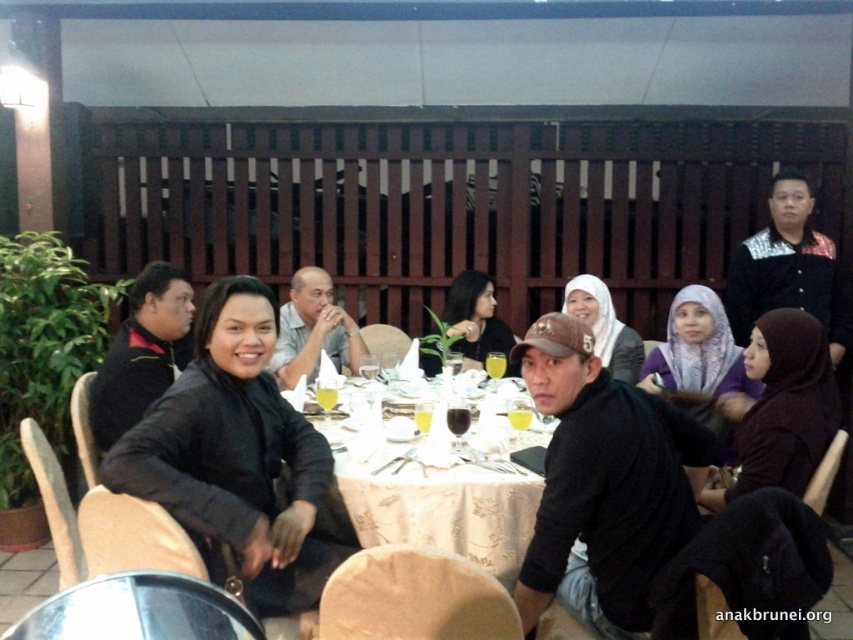
You are a waiter in a restaurant and need to place a new order at the white fabric table at center. Where exactly should you place it?

The white fabric table at center is located at point (444,508), so you should place the new order there.

From the picture: You are a photographer trying to capture a closeup of the white fabric table at center. You are currently standing in front of the black matte jacket at center. Can you move the jacket to get a better angle? Explain why or why not based on their positions.

The black matte jacket at center is closer to the viewer than the white fabric table at center. Since the jacket is in front of the table, moving it would allow you to have an unobstructed view of the table for your closeup.